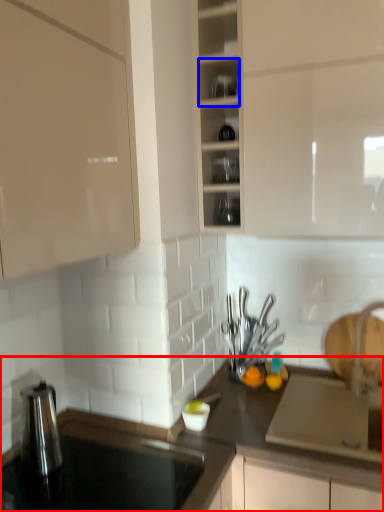
Question: Which object appears closest to the camera in this image, countertop (highlighted by a red box) or shelf (highlighted by a blue box)?

Choices:
 (A) countertop
 (B) shelf

Answer: (A)